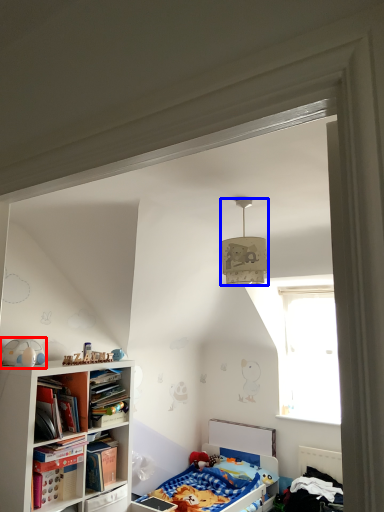
Question: Which of the following is the closest to the observer, toy (highlighted by a red box) or lamp (highlighted by a blue box)?

Choices:
 (A) toy
 (B) lamp

Answer: (B)